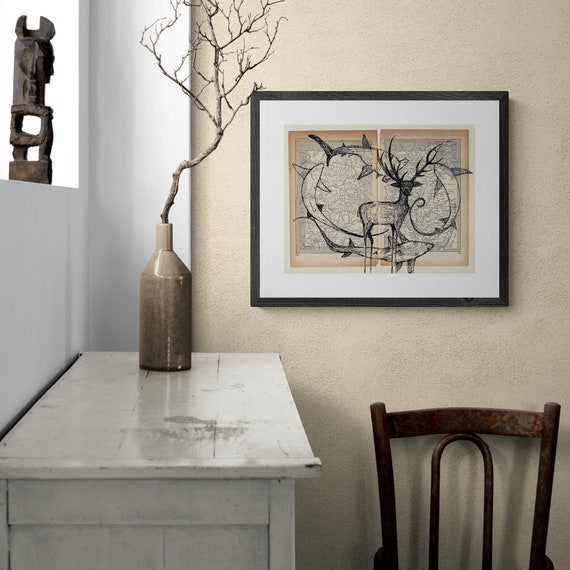
Identify the location of 1 top of chair. (482, 433).